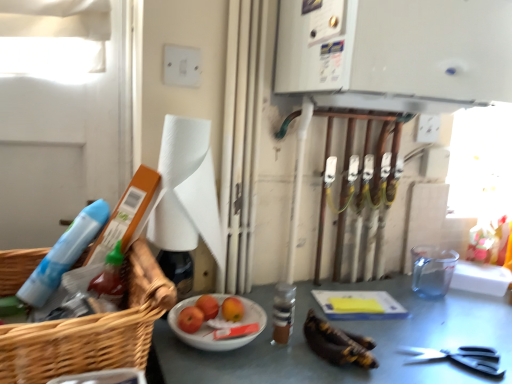
At what (x,y) coordinates should I click in order to perform the action: click on vacant space to the left of black plastic scissors at lower right. Please return your answer as a coordinate pair (x, y). The height and width of the screenshot is (384, 512). Looking at the image, I should click on (374, 347).